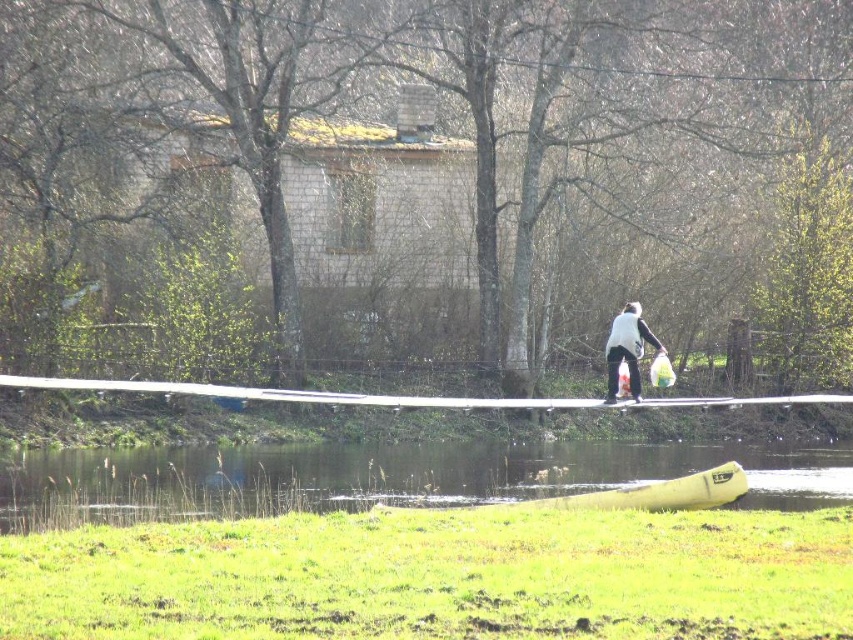
Does green grass at lower center have a lesser width compared to white matte vest at center?

No, green grass at lower center is not thinner than white matte vest at center.

Find the location of a particular element. This screenshot has height=640, width=853. green grass at lower center is located at coordinates pyautogui.click(x=384, y=476).

Find the location of a particular element. The width and height of the screenshot is (853, 640). green grass at lower center is located at coordinates (384, 476).